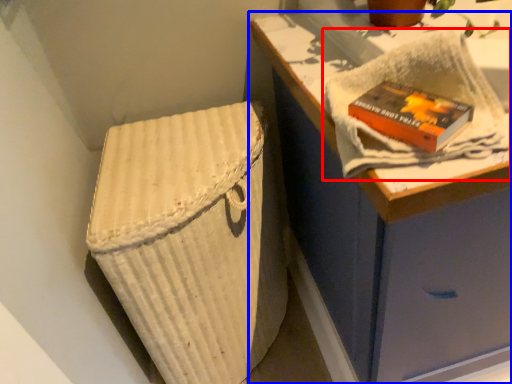
Question: Which object appears farthest to the camera in this image, bath towel (highlighted by a red box) or furniture (highlighted by a blue box)?

Choices:
 (A) bath towel
 (B) furniture

Answer: (B)